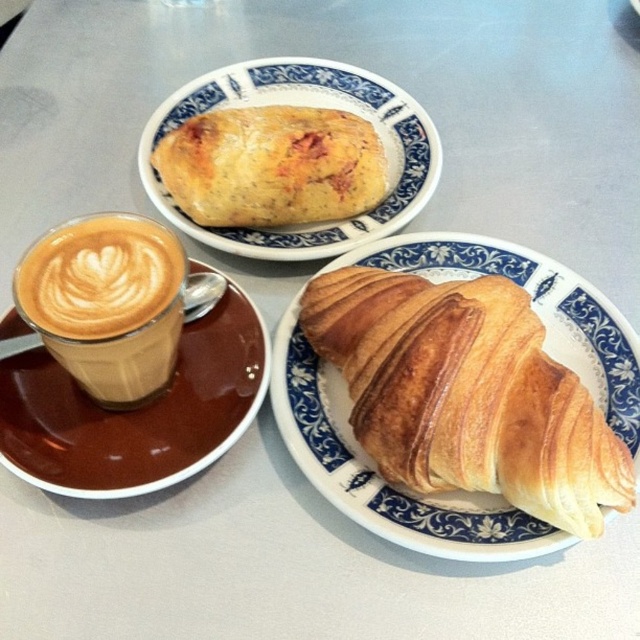
Question: Where is brown ceramic saucer at lower left located in relation to latte art coffee at left in the image?

Choices:
 (A) above
 (B) below

Answer: (B)

Question: Can you confirm if golden-brown crusty pastry at upper center is smaller than golden-brown flaky pastry at upper center?

Choices:
 (A) yes
 (B) no

Answer: (B)

Question: Among these objects, which one is nearest to the camera?

Choices:
 (A) latte art coffee at left
 (B) golden-brown porcelain croissant at center-right
 (C) golden-brown crusty pastry at upper center

Answer: (A)

Question: Is brown ceramic saucer at lower left closer to camera compared to latte art coffee at left?

Choices:
 (A) yes
 (B) no

Answer: (B)

Question: Which of the following is the farthest from the observer?

Choices:
 (A) (176, 412)
 (B) (337, 403)

Answer: (B)

Question: Which object is positioned farthest from the golden-brown flaky pastry at upper center?

Choices:
 (A) golden-brown crusty pastry at upper center
 (B) latte art coffee at left
 (C) golden-brown porcelain croissant at center-right

Answer: (B)